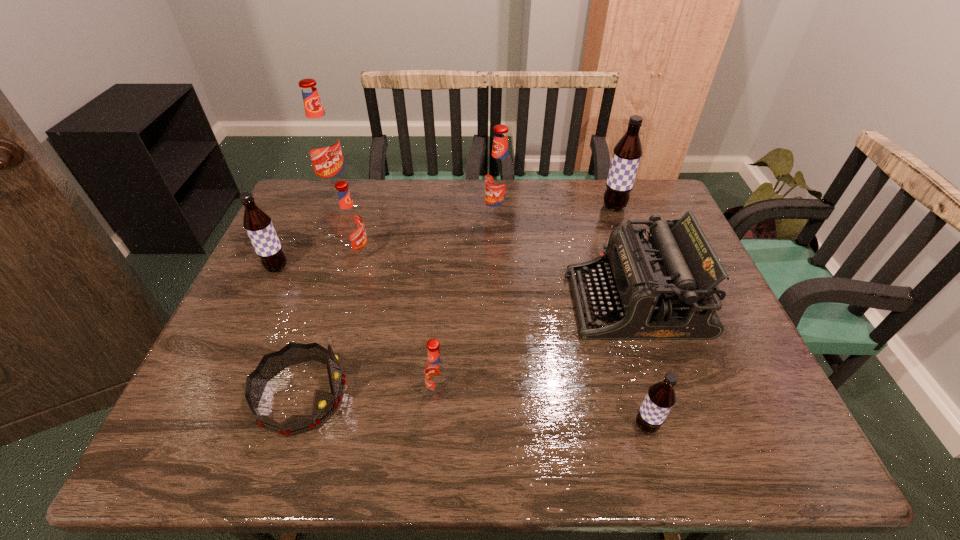
The height and width of the screenshot is (540, 960). I want to click on tiara present at the left edge, so click(324, 404).

Identify the location of root beer that is positioned at the right edge. Image resolution: width=960 pixels, height=540 pixels. (627, 153).

At what (x,y) coordinates should I click in order to perform the action: click on typewriter positioned at the right edge. Please return your answer as a coordinate pair (x, y). This screenshot has width=960, height=540. Looking at the image, I should click on (665, 287).

Locate an element on the screen. Image resolution: width=960 pixels, height=540 pixels. object that is at the far left corner is located at coordinates (323, 144).

Identify the location of object at the near left corner. The height and width of the screenshot is (540, 960). (324, 404).

The height and width of the screenshot is (540, 960). In order to click on object that is at the far right corner in this screenshot , I will do `click(627, 153)`.

This screenshot has height=540, width=960. In the image, there is a desktop. In order to click on vacant area at the far edge in this screenshot , I will do `click(577, 212)`.

Identify the location of vacant space at the near edge of the desktop. The width and height of the screenshot is (960, 540). (413, 442).

Where is `vacant space at the left edge`? vacant space at the left edge is located at coordinates (198, 391).

In the image, there is a desktop. At what (x,y) coordinates should I click in order to perform the action: click on vacant space at the far left corner. Please return your answer as a coordinate pair (x, y). This screenshot has height=540, width=960. Looking at the image, I should click on (314, 210).